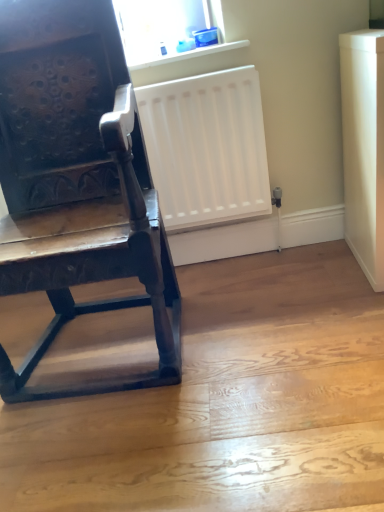
Where is `vacant space in front of dark wood chair at left`? This screenshot has width=384, height=512. vacant space in front of dark wood chair at left is located at coordinates (151, 447).